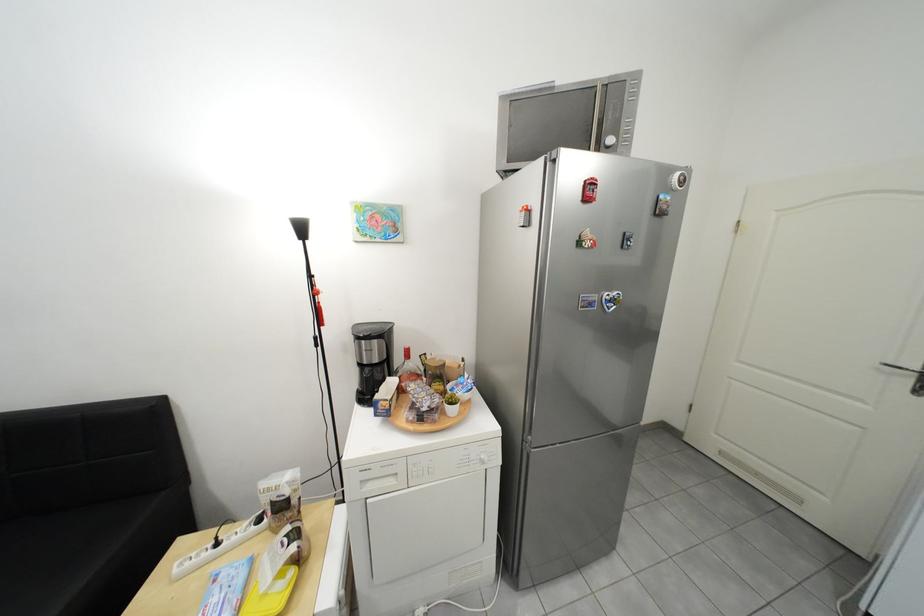
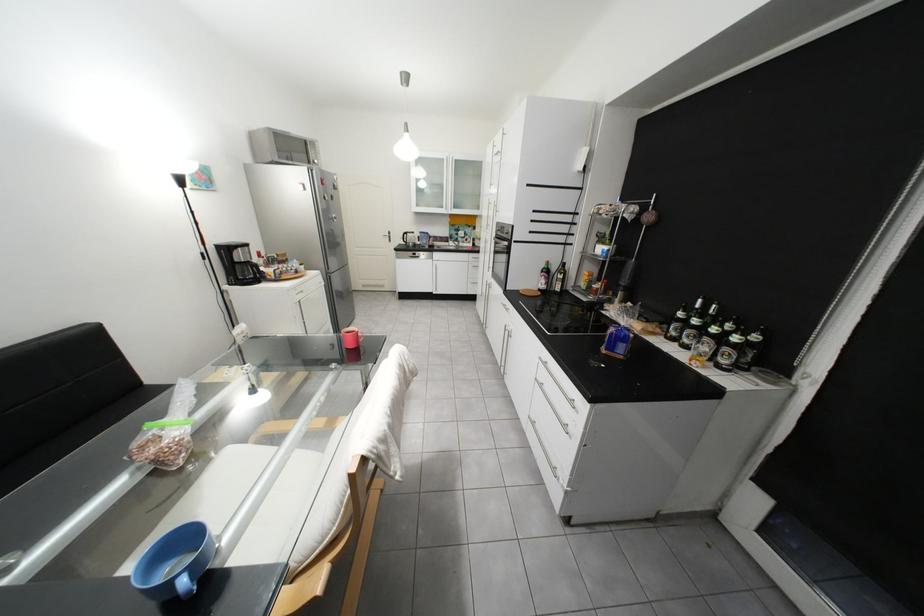
Where in the second image is the point corresponding to point 541,213 from the first image?

(315, 185)